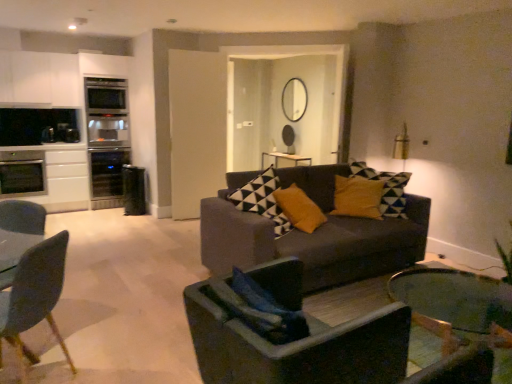
Question: Are satin silver oven at left, which is counted as the 3th appliance, starting from the right, and matte gray couch at center far apart?

Choices:
 (A) yes
 (B) no

Answer: (A)

Question: From a real-world perspective, is satin silver oven at left, which is counted as the 3th appliance, starting from the right, on top of matte gray couch at center?

Choices:
 (A) no
 (B) yes

Answer: (B)

Question: Is satin silver oven at left, which is counted as the 3th appliance, starting from the right, facing away from matte gray couch at center?

Choices:
 (A) yes
 (B) no

Answer: (B)

Question: Considering the relative positions of satin silver oven at left, which is counted as the 3th appliance, starting from the right, and matte gray couch at center in the image provided, is satin silver oven at left, which is counted as the 3th appliance, starting from the right, to the right of matte gray couch at center from the viewer's perspective?

Choices:
 (A) no
 (B) yes

Answer: (A)

Question: Can you confirm if satin silver oven at left, marked as the first appliance in a left-to-right arrangement, is positioned to the left of matte gray couch at center?

Choices:
 (A) yes
 (B) no

Answer: (A)

Question: Can you confirm if satin silver oven at left, marked as the first appliance in a left-to-right arrangement, is wider than matte gray couch at center?

Choices:
 (A) yes
 (B) no

Answer: (B)

Question: From the image's perspective, is dark gray fabric chair at center, which appears as the 2th chair when viewed from the left, under satin silver oven at left, marked as the first appliance in a left-to-right arrangement?

Choices:
 (A) yes
 (B) no

Answer: (A)

Question: From a real-world perspective, is dark gray fabric chair at center, which appears as the 2th chair when viewed from the left, on satin silver oven at left, which is counted as the 3th appliance, starting from the right?

Choices:
 (A) no
 (B) yes

Answer: (A)

Question: Can you confirm if dark gray fabric chair at center, which appears as the 2th chair when viewed from the left, is positioned to the right of satin silver oven at left, marked as the first appliance in a left-to-right arrangement?

Choices:
 (A) yes
 (B) no

Answer: (A)

Question: Is dark gray fabric chair at center, which appears as the 2th chair when viewed from the left, located outside satin silver oven at left, marked as the first appliance in a left-to-right arrangement?

Choices:
 (A) no
 (B) yes

Answer: (B)

Question: From the image's perspective, is dark gray fabric chair at center, which appears as the 2th chair when viewed from the left, located above satin silver oven at left, marked as the first appliance in a left-to-right arrangement?

Choices:
 (A) yes
 (B) no

Answer: (B)

Question: Can you confirm if dark gray fabric chair at center, the 1th chair viewed from the right, is thinner than satin silver oven at left, marked as the first appliance in a left-to-right arrangement?

Choices:
 (A) no
 (B) yes

Answer: (A)

Question: Is satin black oven at left, which is the third appliance from left to right, taller than white matte cabinet at upper left?

Choices:
 (A) yes
 (B) no

Answer: (A)